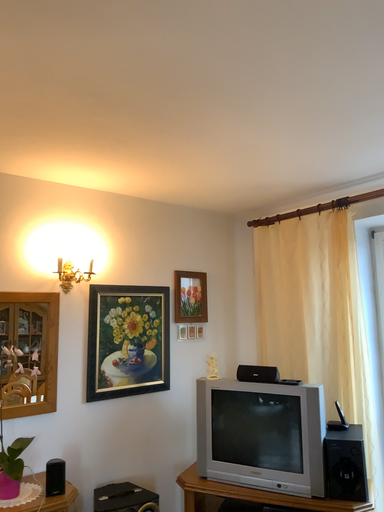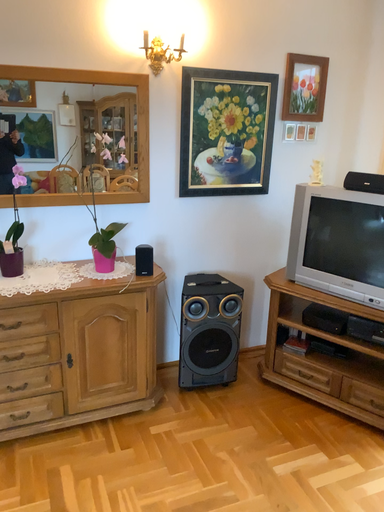
Question: How did the camera likely rotate when shooting the video?

Choices:
 (A) rotated downward
 (B) rotated upward

Answer: (A)